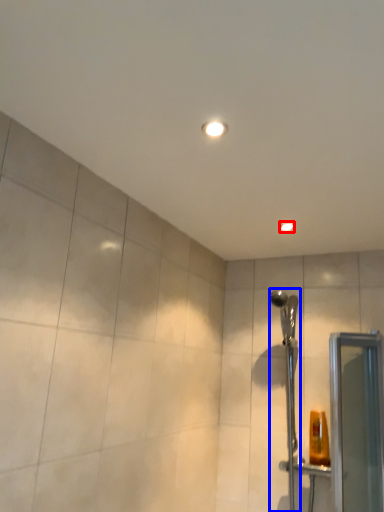
Question: Which point is further to the camera, light fixture (highlighted by a red box) or shower (highlighted by a blue box)?

Choices:
 (A) light fixture
 (B) shower

Answer: (A)